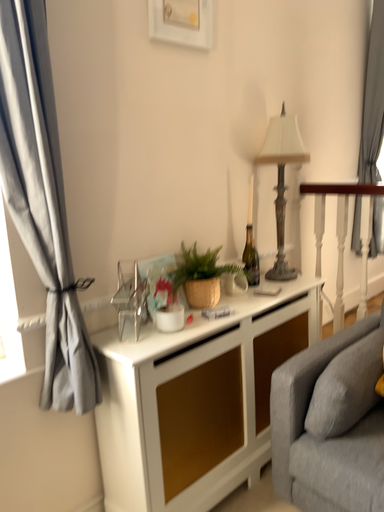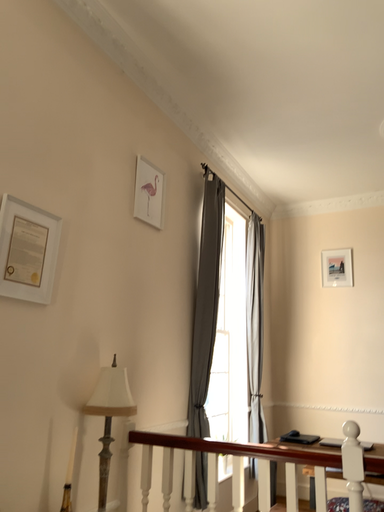
Question: Which way did the camera rotate in the video?

Choices:
 (A) rotated downward
 (B) rotated upward

Answer: (B)